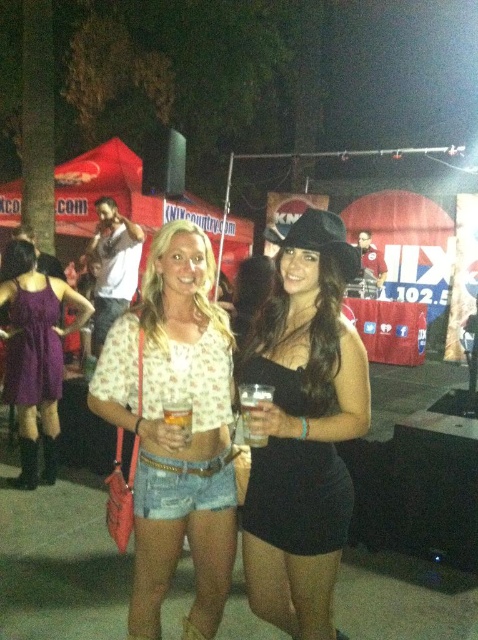
Who is positioned more to the right, denim shorts at center or black satin dress at lower right?

From the viewer's perspective, black satin dress at lower right appears more on the right side.

Based on the photo, does denim shorts at center have a greater width compared to black satin dress at lower right?

Yes, denim shorts at center is wider than black satin dress at lower right.

What do you see at coordinates (174, 428) in the screenshot?
I see `denim shorts at center` at bounding box center [174, 428].

I want to click on denim shorts at center, so click(174, 428).

Is point (153, 384) more distant than point (186, 406)?

Yes, point (153, 384) is behind point (186, 406).

Which is in front, point (169, 230) or point (189, 419)?

Positioned in front is point (189, 419).

In order to click on denim shorts at center in this screenshot , I will do point(174,428).

What do you see at coordinates (297, 497) in the screenshot?
I see `black satin dress at lower right` at bounding box center [297, 497].

Can you confirm if black satin dress at lower right is taller than purple satin dress at left?

Incorrect, black satin dress at lower right's height is not larger of purple satin dress at left's.

Does point (269, 474) come farther from viewer compared to point (24, 387)?

No, it is not.

This screenshot has width=478, height=640. I want to click on black satin dress at lower right, so click(x=297, y=497).